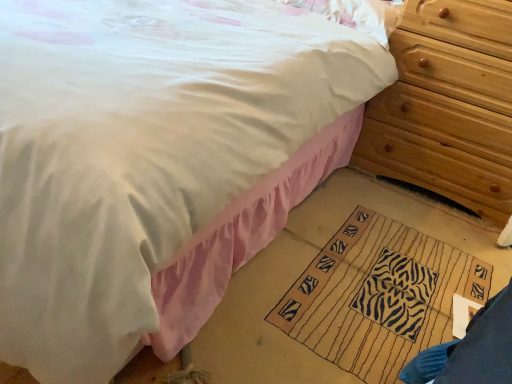
In order to face beige woven mat at lower center, should I rotate leftwards or rightwards?

Turn right by 18.006 degrees to look at beige woven mat at lower center.

What do you see at coordinates (447, 105) in the screenshot?
I see `wooden chest of drawers at right` at bounding box center [447, 105].

The image size is (512, 384). I want to click on wooden chest of drawers at right, so click(x=447, y=105).

What is the approximate width of white satin pillow at upper center?

The width of white satin pillow at upper center is 40.18 centimeters.

The image size is (512, 384). Describe the element at coordinates (355, 15) in the screenshot. I see `white satin pillow at upper center` at that location.

The image size is (512, 384). I want to click on beige woven mat at lower center, so click(379, 296).

Considering the sizes of objects wooden chest of drawers at right and white satin pillow at upper center in the image provided, who is wider, wooden chest of drawers at right or white satin pillow at upper center?

wooden chest of drawers at right.

From the image's perspective, does wooden chest of drawers at right appear lower than white satin pillow at upper center?

Indeed, from the image's perspective, wooden chest of drawers at right is shown beneath white satin pillow at upper center.

Considering the relative positions of wooden chest of drawers at right and white satin pillow at upper center in the image provided, is wooden chest of drawers at right to the left of white satin pillow at upper center from the viewer's perspective?

Incorrect, wooden chest of drawers at right is not on the left side of white satin pillow at upper center.

Considering the sizes of objects wooden chest of drawers at right and white satin pillow at upper center in the image provided, who is smaller, wooden chest of drawers at right or white satin pillow at upper center?

Smaller between the two is white satin pillow at upper center.

Does beige woven mat at lower center appear on the left side of white satin pillow at upper center?

No, beige woven mat at lower center is not to the left of white satin pillow at upper center.

Is beige woven mat at lower center not close to white satin pillow at upper center?

No, beige woven mat at lower center is not far away from white satin pillow at upper center.

Is beige woven mat at lower center facing towards white satin pillow at upper center?

No, beige woven mat at lower center is not oriented towards white satin pillow at upper center.

Between white satin pillow at upper center and beige woven mat at lower center, which one has less height?

With less height is beige woven mat at lower center.

From a real-world perspective, which is physically below, white satin pillow at upper center or beige woven mat at lower center?

beige woven mat at lower center.

Considering the positions of points (344, 16) and (371, 341), is point (344, 16) closer to camera compared to point (371, 341)?

No, (344, 16) is behind (371, 341).

Is white satin pillow at upper center to the left of beige woven mat at lower center from the viewer's perspective?

Correct, you'll find white satin pillow at upper center to the left of beige woven mat at lower center.

Is beige woven mat at lower center oriented away from wooden chest of drawers at right?

No, beige woven mat at lower center's orientation is not away from wooden chest of drawers at right.

Which of these two, beige woven mat at lower center or wooden chest of drawers at right, is bigger?

Bigger between the two is wooden chest of drawers at right.

In the scene shown: Is beige woven mat at lower center at the left side of wooden chest of drawers at right?

Correct, you'll find beige woven mat at lower center to the left of wooden chest of drawers at right.

Which object is closer to the camera taking this photo, beige woven mat at lower center or wooden chest of drawers at right?

beige woven mat at lower center is in front.

Considering the sizes of objects wooden chest of drawers at right and beige woven mat at lower center in the image provided, who is smaller, wooden chest of drawers at right or beige woven mat at lower center?

beige woven mat at lower center is smaller.

Considering the sizes of objects wooden chest of drawers at right and beige woven mat at lower center in the image provided, who is wider, wooden chest of drawers at right or beige woven mat at lower center?

beige woven mat at lower center.

Is wooden chest of drawers at right positioned before beige woven mat at lower center?

That is False.

Considering the sizes of objects white satin pillow at upper center and wooden chest of drawers at right in the image provided, who is bigger, white satin pillow at upper center or wooden chest of drawers at right?

Bigger between the two is wooden chest of drawers at right.

From a real-world perspective, which is physically above, white satin pillow at upper center or wooden chest of drawers at right?

In real-world perspective, white satin pillow at upper center is above.

In order to click on chest of drawers below the white satin pillow at upper center (from a real-world perspective) in this screenshot , I will do `click(447, 105)`.

The image size is (512, 384). In order to click on pillow that is above the wooden chest of drawers at right (from the image's perspective) in this screenshot , I will do `click(355, 15)`.

What are the coordinates of `doormat below the white satin pillow at upper center (from a real-world perspective)` in the screenshot? It's located at (379, 296).

Which object lies nearer to the anchor point white satin pillow at upper center, wooden chest of drawers at right or beige woven mat at lower center?

wooden chest of drawers at right lies closer to white satin pillow at upper center than the other object.

Considering their positions, is white satin pillow at upper center positioned closer to wooden chest of drawers at right than beige woven mat at lower center?

white satin pillow at upper center lies closer to wooden chest of drawers at right than the other object.

Estimate the real-world distances between objects in this image. Which object is closer to white satin pillow at upper center, beige woven mat at lower center or wooden chest of drawers at right?

Among the two, wooden chest of drawers at right is located nearer to white satin pillow at upper center.

When comparing their distances from beige woven mat at lower center, does white satin pillow at upper center or wooden chest of drawers at right seem further?

white satin pillow at upper center is positioned further to the anchor beige woven mat at lower center.

Which object lies further to the anchor point wooden chest of drawers at right, beige woven mat at lower center or white satin pillow at upper center?

Among the two, beige woven mat at lower center is located further to wooden chest of drawers at right.

Based on their spatial positions, is wooden chest of drawers at right or white satin pillow at upper center closer to beige woven mat at lower center?

wooden chest of drawers at right.

You are a GUI agent. You are given a task and a screenshot of the screen. Output one action in this format:
    pyautogui.click(x=<x>, y=<y>)
    Task: Click on the chest of drawers between white satin pillow at upper center and beige woven mat at lower center in the up-down direction
    
    Given the screenshot: What is the action you would take?
    pyautogui.click(x=447, y=105)